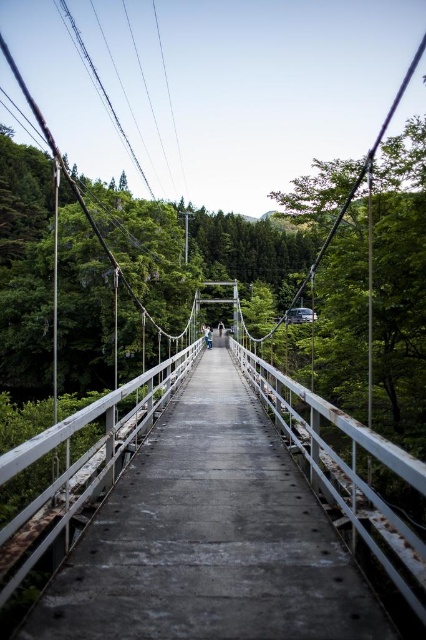
From the picture: Who is positioned more to the right, rusty concrete bridge at center or light blue denim jacket at center?

From the viewer's perspective, rusty concrete bridge at center appears more on the right side.

Which is in front, point (264, 621) or point (206, 346)?

Point (264, 621) is more forward.

Between point (204, 566) and point (204, 330), which one is positioned in front?

Positioned in front is point (204, 566).

Locate an element on the screen. This screenshot has width=426, height=640. rusty concrete bridge at center is located at coordinates (210, 538).